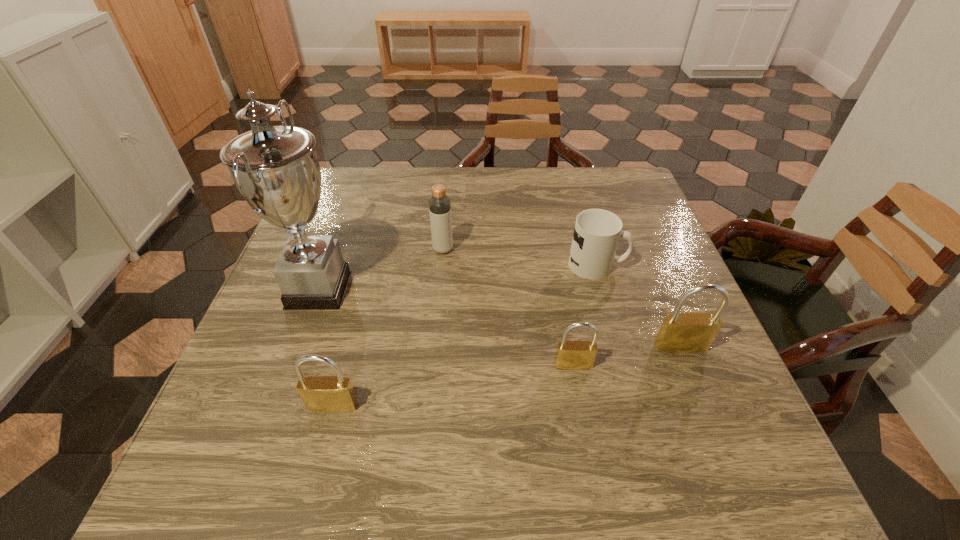
Image resolution: width=960 pixels, height=540 pixels. Identify the location of free region located 0.110m on the front-facing side of the fourth farthest object. (704, 403).

Locate an element on the screen. Image resolution: width=960 pixels, height=540 pixels. free spot located 0.360m on the back of the fourth object from right to left is located at coordinates (450, 170).

Identify the location of free region located 0.080m on the handle side of the mug. (659, 265).

This screenshot has width=960, height=540. I want to click on vacant space located at the front view of the trophy cup, so click(x=459, y=290).

Identify the location of object at the near edge. (x=327, y=394).

You are a GUI agent. You are given a task and a screenshot of the screen. Output one action in this format:
    pyautogui.click(x=<x>, y=<y>)
    Task: Click on the object that is at the left edge
    
    Given the screenshot: What is the action you would take?
    pyautogui.click(x=275, y=168)

This screenshot has height=540, width=960. I want to click on padlock positioned at the right edge, so click(691, 332).

Where is `mug positioned at the right edge`? This screenshot has width=960, height=540. mug positioned at the right edge is located at coordinates (597, 232).

Identify the location of free space at the far edge of the desktop. (397, 205).

Where is `free space at the left edge of the desktop`? Image resolution: width=960 pixels, height=540 pixels. free space at the left edge of the desktop is located at coordinates (269, 369).